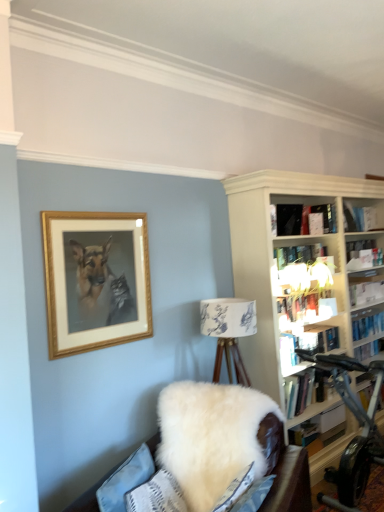
Question: Is hardcover book at upper right, marked as the fourth book in a top-to-bottom arrangement, behind silver metallic stationary bicycle at right?

Choices:
 (A) yes
 (B) no

Answer: (A)

Question: Does hardcover book at upper right, marked as the fourth book in a top-to-bottom arrangement, have a lesser width compared to silver metallic stationary bicycle at right?

Choices:
 (A) no
 (B) yes

Answer: (B)

Question: Is hardcover book at upper right, the third book when ordered from bottom to top, aimed at silver metallic stationary bicycle at right?

Choices:
 (A) no
 (B) yes

Answer: (A)

Question: Can you confirm if hardcover book at upper right, the third book when ordered from bottom to top, is shorter than silver metallic stationary bicycle at right?

Choices:
 (A) yes
 (B) no

Answer: (A)

Question: Can you confirm if hardcover book at upper right, the third book when ordered from bottom to top, is taller than silver metallic stationary bicycle at right?

Choices:
 (A) yes
 (B) no

Answer: (B)

Question: Is hardcover book at upper right, the third book when ordered from bottom to top, facing away from silver metallic stationary bicycle at right?

Choices:
 (A) yes
 (B) no

Answer: (B)

Question: Is white fluffy couch at lower center positioned with its back to black matte book at upper center, which is the first book in top-to-bottom order?

Choices:
 (A) no
 (B) yes

Answer: (A)

Question: Is white fluffy couch at lower center taller than black matte book at upper center, which is the 6th book in bottom-to-top order?

Choices:
 (A) no
 (B) yes

Answer: (B)

Question: Does white fluffy couch at lower center have a smaller size compared to black matte book at upper center, which is the 6th book in bottom-to-top order?

Choices:
 (A) yes
 (B) no

Answer: (B)

Question: From a real-world perspective, is white fluffy couch at lower center positioned under black matte book at upper center, which is the first book in top-to-bottom order, based on gravity?

Choices:
 (A) yes
 (B) no

Answer: (A)

Question: Considering the relative positions of white fluffy couch at lower center and black matte book at upper center, which is the 6th book in bottom-to-top order, in the image provided, is white fluffy couch at lower center to the right of black matte book at upper center, which is the 6th book in bottom-to-top order, from the viewer's perspective?

Choices:
 (A) no
 (B) yes

Answer: (A)

Question: Is white fluffy couch at lower center oriented towards black matte book at upper center, which is the 6th book in bottom-to-top order?

Choices:
 (A) yes
 (B) no

Answer: (B)

Question: From a real-world perspective, is wooden picture frame at upper left positioned over hardcover book at upper right, the third book when ordered from bottom to top, based on gravity?

Choices:
 (A) no
 (B) yes

Answer: (B)